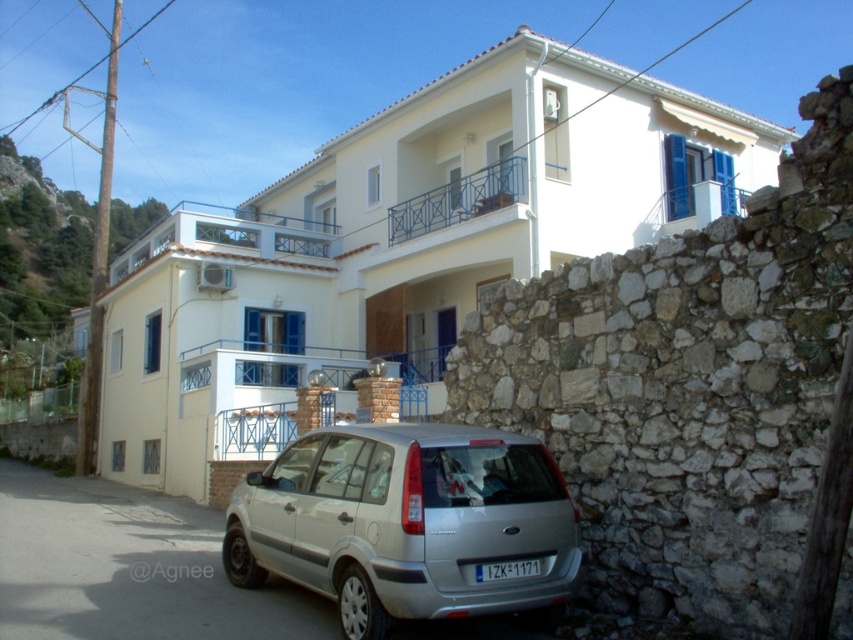
Question: From the image, what is the correct spatial relationship of white painted villa at center in relation to silver metallic hatchback at lower center?

Choices:
 (A) above
 (B) below

Answer: (A)

Question: Can you confirm if white painted villa at center is smaller than black plastic license plate at lower center?

Choices:
 (A) no
 (B) yes

Answer: (A)

Question: Which of the following is the closest to the observer?

Choices:
 (A) black plastic license plate at lower center
 (B) silver metallic hatchback at lower center

Answer: (B)

Question: Which is nearer to the white painted villa at center?

Choices:
 (A) silver metallic hatchback at lower center
 (B) black plastic license plate at lower center

Answer: (A)

Question: Does white painted villa at center appear under silver metallic hatchback at lower center?

Choices:
 (A) yes
 (B) no

Answer: (B)

Question: Which point appears closest to the camera in this image?

Choices:
 (A) (524, 566)
 (B) (413, 208)
 (C) (387, 611)

Answer: (C)